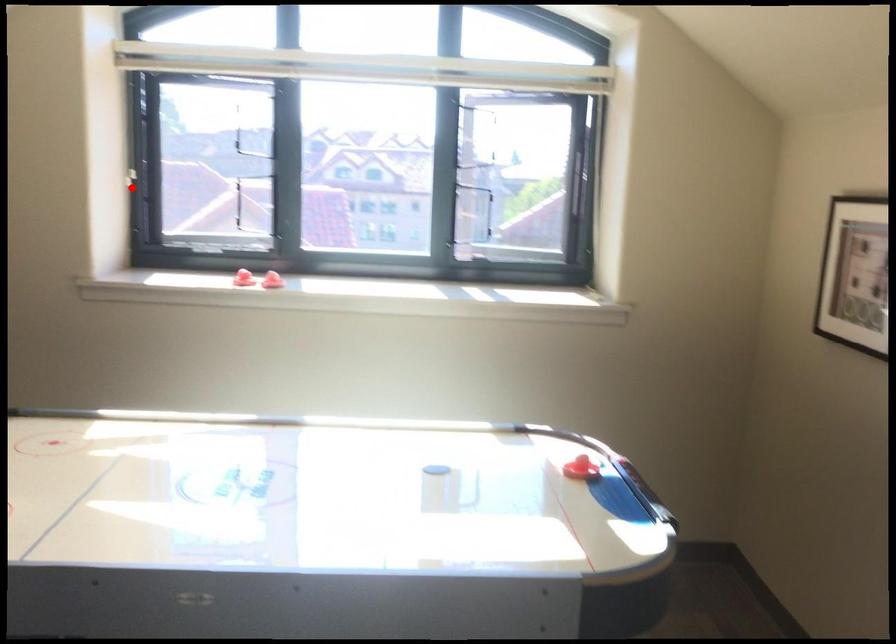
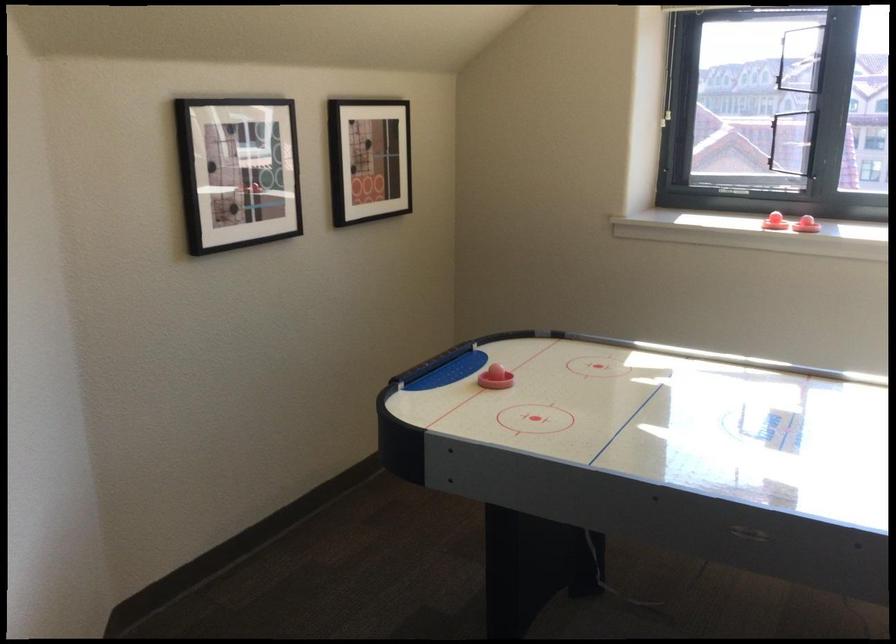
Where in the second image is the point corresponding to the highlighted location from the first image?

(669, 120)